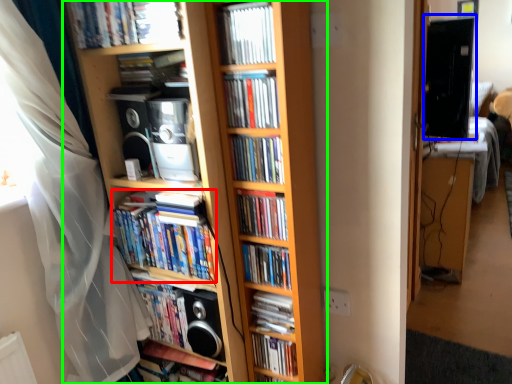
Question: Which is farther away from book (highlighted by a red box)? computer monitor (highlighted by a blue box) or bookcase (highlighted by a green box)?

Choices:
 (A) computer monitor
 (B) bookcase

Answer: (A)